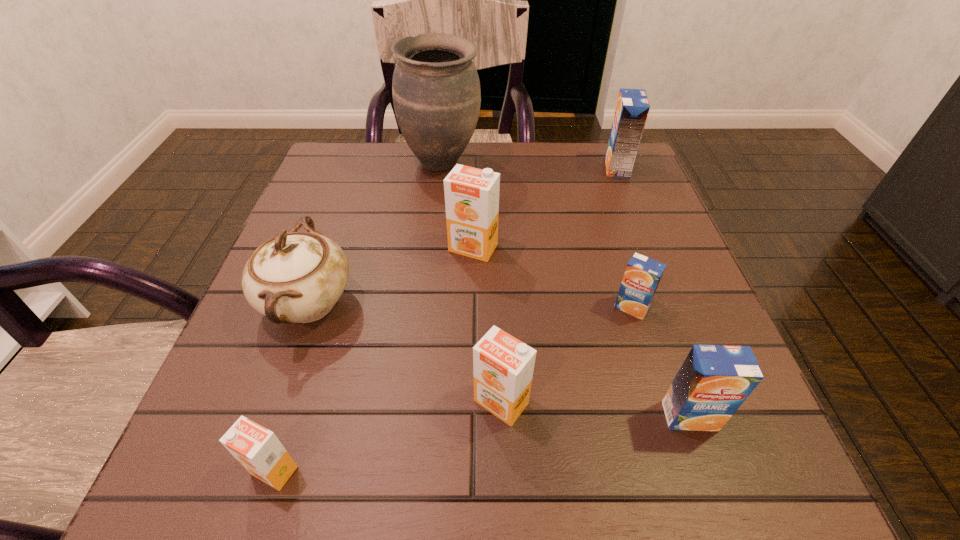
Where is `urn that is at the far edge`? This screenshot has height=540, width=960. urn that is at the far edge is located at coordinates (436, 93).

I want to click on orange_juice located in the far edge section of the desktop, so click(x=632, y=108).

At what (x,y) coordinates should I click in order to perform the action: click on object present at the near edge. Please return your answer as a coordinate pair (x, y). This screenshot has height=540, width=960. Looking at the image, I should click on (257, 449).

At what (x,y) coordinates should I click in order to perform the action: click on chinaware at the left edge. Please return your answer as a coordinate pair (x, y). The height and width of the screenshot is (540, 960). Looking at the image, I should click on (295, 277).

Where is `orange juice that is at the left edge`? This screenshot has height=540, width=960. orange juice that is at the left edge is located at coordinates (257, 449).

Locate an element on the screen. The width and height of the screenshot is (960, 540). object that is positioned at the near left corner is located at coordinates (257, 449).

Find the location of a particular element. Image resolution: width=960 pixels, height=540 pixels. object that is at the far right corner is located at coordinates (632, 108).

Find the location of `blank space at the far edge of the desktop`. blank space at the far edge of the desktop is located at coordinates click(501, 174).

At what (x,y) coordinates should I click in order to perform the action: click on vacant region at the near edge of the desktop. Please return your answer as a coordinate pair (x, y). Looking at the image, I should click on (465, 467).

The height and width of the screenshot is (540, 960). Identify the location of free space at the left edge of the desktop. (233, 390).